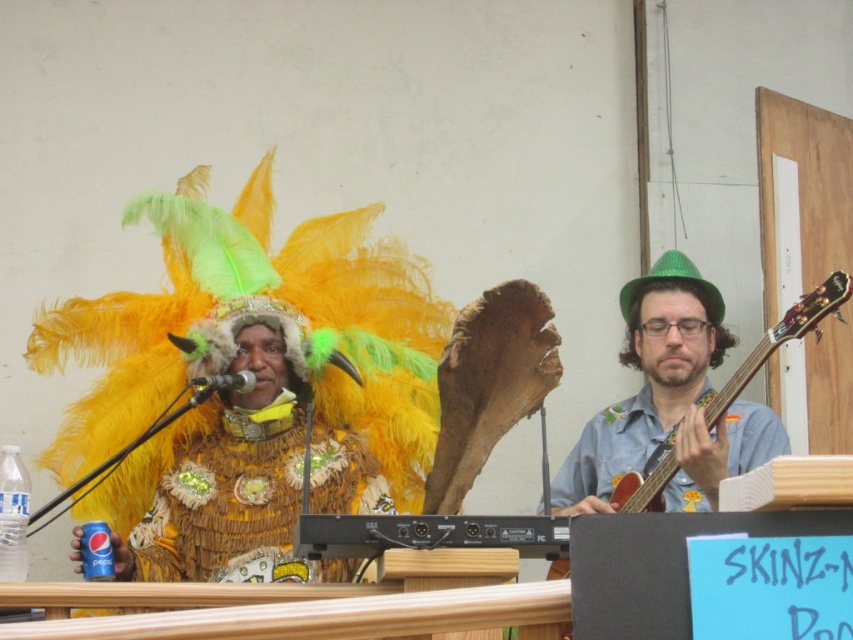
Is point (193, 444) behind point (770, 349)?

Yes, point (193, 444) is farther from viewer.

Is shiny gold costume at center to the right of wooden acoustic guitar at right from the viewer's perspective?

No, shiny gold costume at center is not to the right of wooden acoustic guitar at right.

This screenshot has height=640, width=853. In order to click on shiny gold costume at center in this screenshot , I will do `click(250, 465)`.

Find the location of a particular element. The width and height of the screenshot is (853, 640). shiny gold costume at center is located at coordinates (250, 465).